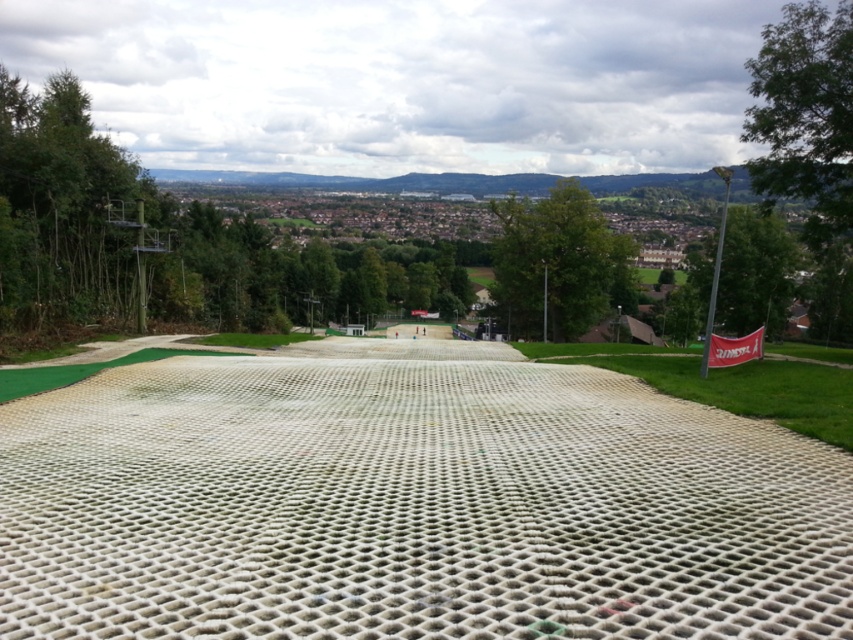
Consider the image. You are a BMX rider planning to perform a stunt on the white mesh dirt track at center and the white mesh golf course at center. Which surface should you choose if you want to be closer to the ground?

The white mesh dirt track at center is positioned under the white mesh golf course at center, so you should choose the white mesh dirt track at center to be closer to the ground.